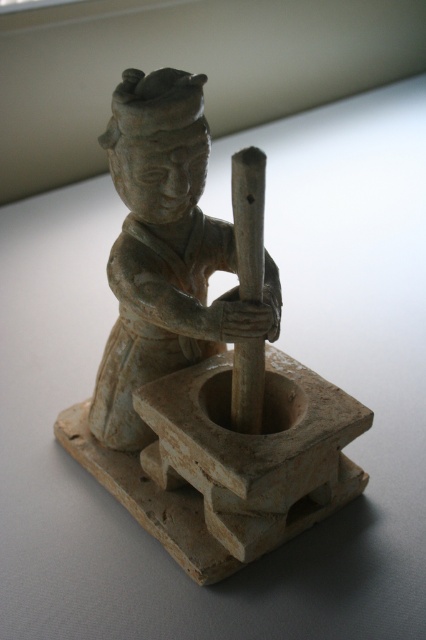
Does beige ceramic statue at center have a lesser width compared to grayish-white ceramic figure at center?

No.

Who is higher up, beige ceramic statue at center or grayish-white ceramic figure at center?

grayish-white ceramic figure at center is higher up.

Between point (129, 401) and point (180, 332), which one is positioned in front?

Positioned in front is point (180, 332).

Identify the location of beige ceramic statue at center. Image resolution: width=426 pixels, height=640 pixels. (199, 362).